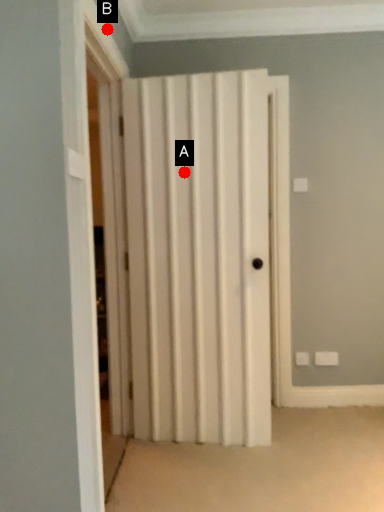
Question: Two points are circled on the image, labeled by A and B beside each circle. Among these points, which one is farthest from the camera?

Choices:
 (A) A is further
 (B) B is further

Answer: (A)